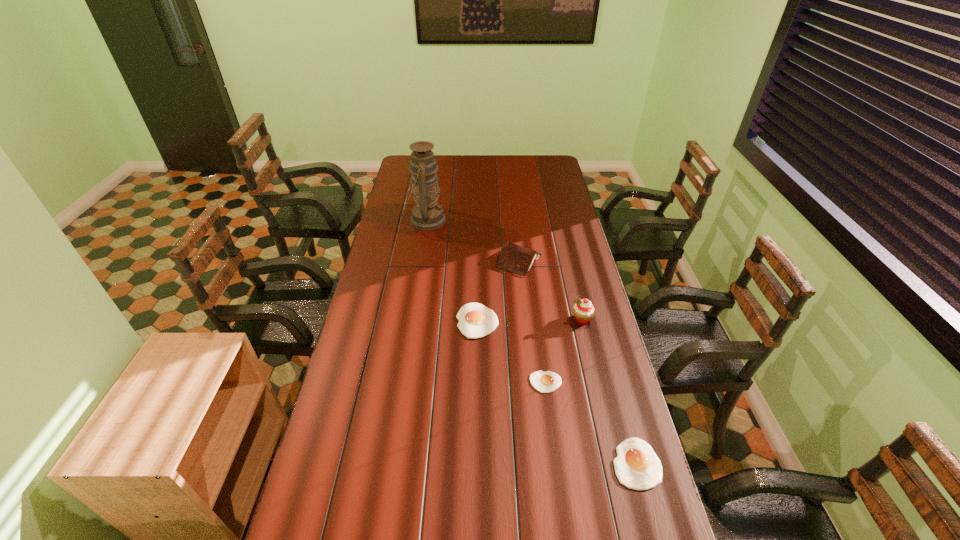
Identify the location of the leftmost egg yolk. (475, 320).

You are a GUI agent. You are given a task and a screenshot of the screen. Output one action in this format:
    pyautogui.click(x=<x>, y=<y>)
    Task: Click on the second nearest egg yolk
    The image size is (960, 540).
    Given the screenshot: What is the action you would take?
    pyautogui.click(x=545, y=382)

Find the location of a particular element. The height and width of the screenshot is (540, 960). the second nearest object is located at coordinates (545, 382).

Find the location of `the fifth tallest object`. the fifth tallest object is located at coordinates (637, 466).

I want to click on the rightmost egg yolk, so click(637, 466).

Where is `the third tallest object`? Image resolution: width=960 pixels, height=540 pixels. the third tallest object is located at coordinates (514, 258).

This screenshot has height=540, width=960. I want to click on the fifth nearest object, so click(x=514, y=258).

Locate an element on the screen. The height and width of the screenshot is (540, 960). the farthest object is located at coordinates (427, 215).

This screenshot has height=540, width=960. Find the location of `oil lamp`. oil lamp is located at coordinates (427, 215).

I want to click on cupcake, so click(583, 310).